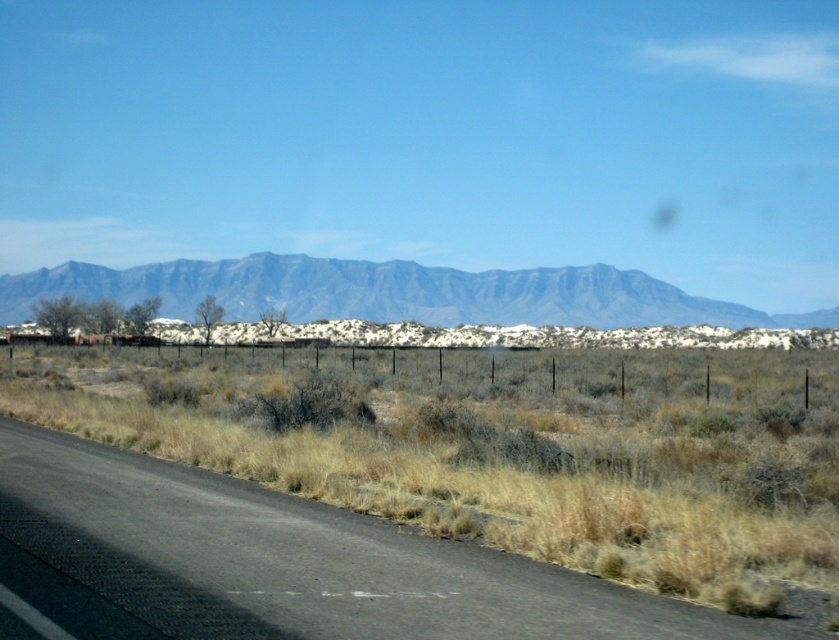
Question: Does dry grass at lower center have a smaller size compared to gray matte mountain range at center?

Choices:
 (A) yes
 (B) no

Answer: (A)

Question: Is dry grass at lower center thinner than gray matte mountain range at center?

Choices:
 (A) yes
 (B) no

Answer: (A)

Question: Which point is farther to the camera?

Choices:
 (A) (197, 269)
 (B) (608, 547)

Answer: (A)

Question: Can you confirm if dry grass at lower center is positioned above gray matte mountain range at center?

Choices:
 (A) no
 (B) yes

Answer: (A)

Question: Which object is farther from the camera taking this photo?

Choices:
 (A) gray matte mountain range at center
 (B) dry grass at lower center

Answer: (A)